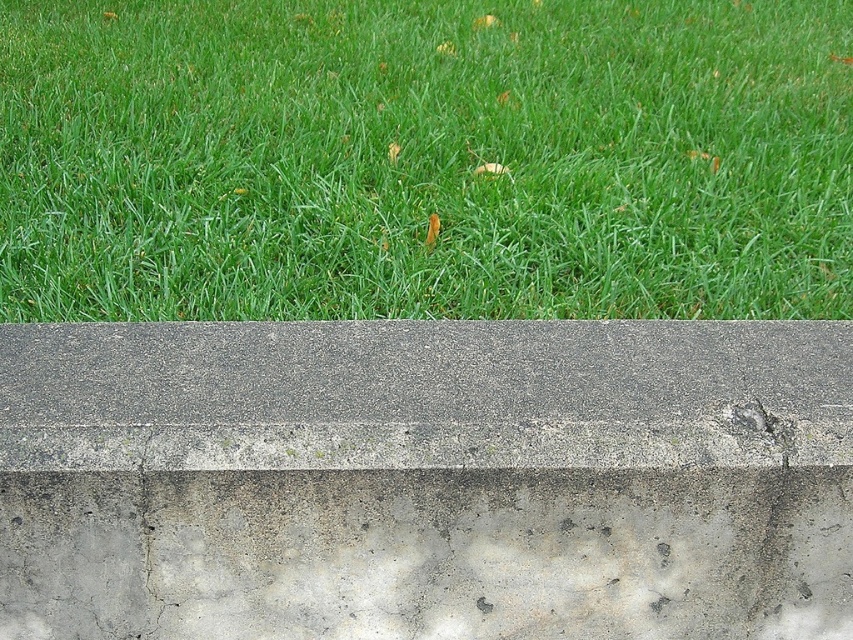
Find the location of a particular element. gray concrete bench at bottom is located at coordinates (426, 481).

Does point (262, 563) come closer to viewer compared to point (461, 333)?

That is True.

At what (x,y) coordinates should I click in order to perform the action: click on gray concrete bench at bottom. Please return your answer as a coordinate pair (x, y). The image size is (853, 640). Looking at the image, I should click on (426, 481).

Can you confirm if green grass at upper is shorter than gray concrete bench at bottom?

No.

This screenshot has height=640, width=853. I want to click on green grass at upper, so click(424, 160).

Is green grass at upper shorter than gray concrete at center?

No.

Is green grass at upper in front of gray concrete at center?

That is False.

Find the location of a particular element. Image resolution: width=853 pixels, height=640 pixels. green grass at upper is located at coordinates (424, 160).

Identify the location of green grass at upper. This screenshot has height=640, width=853. (424, 160).